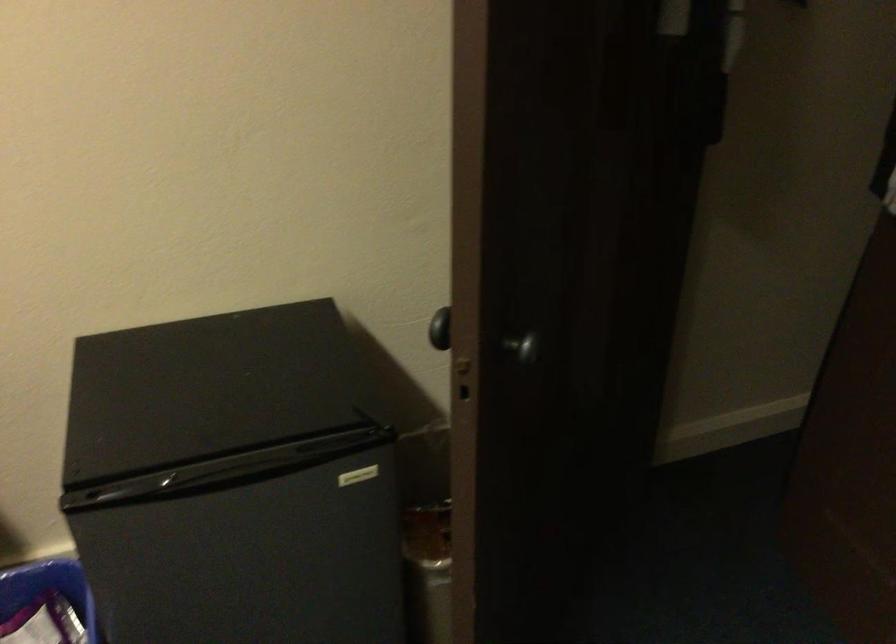
Find where to turn the black door knob. Please return your answer as a coordinate pair (x, y).

(440, 328)